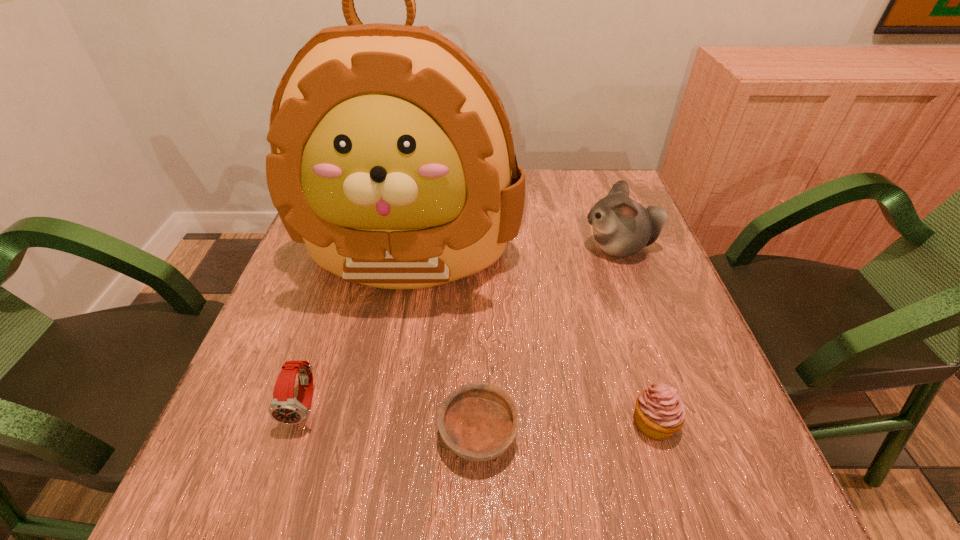
Identify the location of free space located on the back of the cupcake. (602, 256).

Locate an element on the screen. The width and height of the screenshot is (960, 540). vacant space situated on the back of the bowl is located at coordinates (479, 257).

The width and height of the screenshot is (960, 540). What are the coordinates of `object that is at the far edge` in the screenshot? It's located at (392, 158).

Locate an element on the screen. This screenshot has width=960, height=540. object present at the near edge is located at coordinates (477, 421).

Where is `backpack located at the left edge`? This screenshot has width=960, height=540. backpack located at the left edge is located at coordinates (392, 158).

The width and height of the screenshot is (960, 540). In order to click on watch present at the left edge in this screenshot , I will do click(284, 408).

Where is `hamster that is positioned at the right edge`? hamster that is positioned at the right edge is located at coordinates 622,227.

Locate an element on the screen. cupcake that is at the right edge is located at coordinates (660, 412).

Find the location of a particular element. This screenshot has height=540, width=960. object at the far left corner is located at coordinates (392, 158).

I want to click on vacant space at the far edge, so click(560, 205).